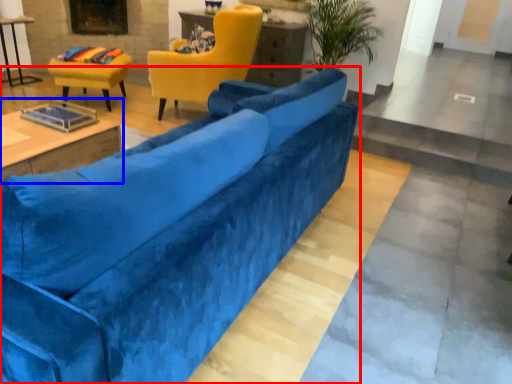
Question: Among these objects, which one is nearest to the camera, studio couch (highlighted by a red box) or table (highlighted by a blue box)?

Choices:
 (A) studio couch
 (B) table

Answer: (A)